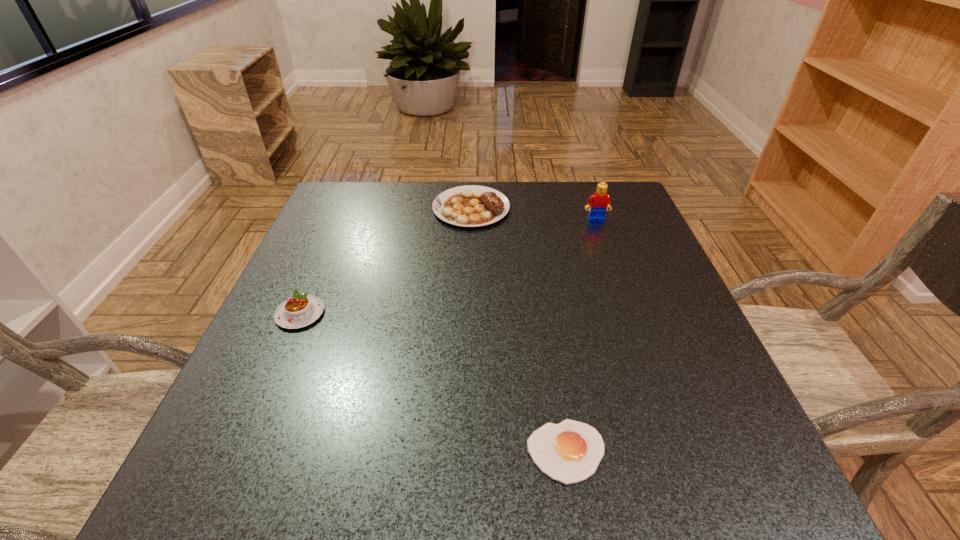
The image size is (960, 540). Find the location of `vacant space at the right edge`. vacant space at the right edge is located at coordinates (656, 394).

The width and height of the screenshot is (960, 540). In the image, there is a desktop. Find the location of `vacant space at the far left corner`. vacant space at the far left corner is located at coordinates (330, 216).

The width and height of the screenshot is (960, 540). What are the coordinates of `free space at the far right corner of the desktop` in the screenshot? It's located at (639, 217).

In the image, there is a desktop. Where is `vacant space at the near right corner`? This screenshot has width=960, height=540. vacant space at the near right corner is located at coordinates 730,446.

Find the location of a particular element. vacant point located between the leftmost object and the steak is located at coordinates (386, 261).

At what (x,y) coordinates should I click in order to perform the action: click on vacant region between the third farthest object and the steak. Please return your answer as a coordinate pair (x, y). Looking at the image, I should click on (386, 261).

You are a GUI agent. You are given a task and a screenshot of the screen. Output one action in this format:
    pyautogui.click(x=<x>, y=<y>)
    Task: Click on the free space between the shortest object and the tallest object
    The height and width of the screenshot is (540, 960).
    Given the screenshot: What is the action you would take?
    pyautogui.click(x=581, y=335)

This screenshot has height=540, width=960. Identify the location of vacant area that lies between the pudding and the steak. (386, 261).

Where is `empty space between the tallest object and the leftmost object`? Image resolution: width=960 pixels, height=540 pixels. empty space between the tallest object and the leftmost object is located at coordinates [x=448, y=267].

Locate an element on the screen. The width and height of the screenshot is (960, 540). vacant region between the steak and the nearest object is located at coordinates (518, 330).